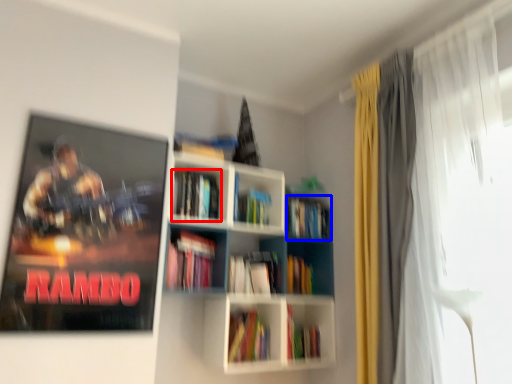
Question: Which of the following is the closest to the observer, book (highlighted by a red box) or book (highlighted by a blue box)?

Choices:
 (A) book
 (B) book

Answer: (A)